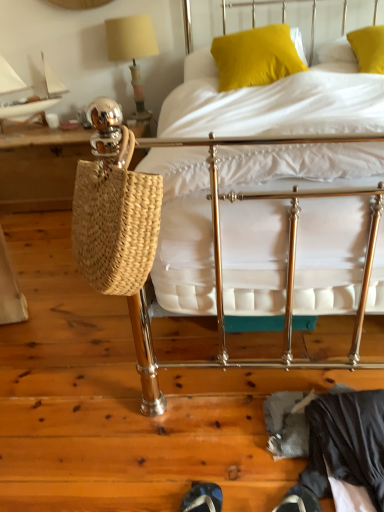
Question: Would you say yellow fabric pillow at upper right, positioned as the 2th pillow in left-to-right order, is outside shiny black shoe at lower center?

Choices:
 (A) yes
 (B) no

Answer: (A)

Question: Is yellow fabric pillow at upper right, which is counted as the first pillow, starting from the right, surrounding shiny black shoe at lower center?

Choices:
 (A) no
 (B) yes

Answer: (A)

Question: Is yellow fabric pillow at upper right, which is counted as the first pillow, starting from the right, aimed at shiny black shoe at lower center?

Choices:
 (A) yes
 (B) no

Answer: (A)

Question: Can you confirm if yellow fabric pillow at upper right, which is counted as the first pillow, starting from the right, is wider than shiny black shoe at lower center?

Choices:
 (A) no
 (B) yes

Answer: (B)

Question: Is yellow fabric pillow at upper right, positioned as the 2th pillow in left-to-right order, with shiny black shoe at lower center?

Choices:
 (A) no
 (B) yes

Answer: (A)

Question: Considering the relative sizes of yellow fabric pillow at upper right, positioned as the 2th pillow in left-to-right order, and shiny black shoe at lower center in the image provided, is yellow fabric pillow at upper right, positioned as the 2th pillow in left-to-right order, bigger than shiny black shoe at lower center?

Choices:
 (A) yes
 (B) no

Answer: (A)

Question: Does dark gray fabric at lower right appear on the right side of woven straw bag at left?

Choices:
 (A) no
 (B) yes

Answer: (B)

Question: Is woven straw bag at left surrounded by dark gray fabric at lower right?

Choices:
 (A) no
 (B) yes

Answer: (A)

Question: Considering the relative sizes of dark gray fabric at lower right and woven straw bag at left in the image provided, is dark gray fabric at lower right thinner than woven straw bag at left?

Choices:
 (A) yes
 (B) no

Answer: (A)

Question: Does dark gray fabric at lower right appear on the left side of woven straw bag at left?

Choices:
 (A) yes
 (B) no

Answer: (B)

Question: Does dark gray fabric at lower right have a larger size compared to woven straw bag at left?

Choices:
 (A) yes
 (B) no

Answer: (B)

Question: From a real-world perspective, is dark gray fabric at lower right positioned under woven straw bag at left based on gravity?

Choices:
 (A) no
 (B) yes

Answer: (B)

Question: Is dark gray fabric at lower right closer to camera compared to yellow fabric pillow at upper center, positioned as the 1th pillow in left-to-right order?

Choices:
 (A) yes
 (B) no

Answer: (A)